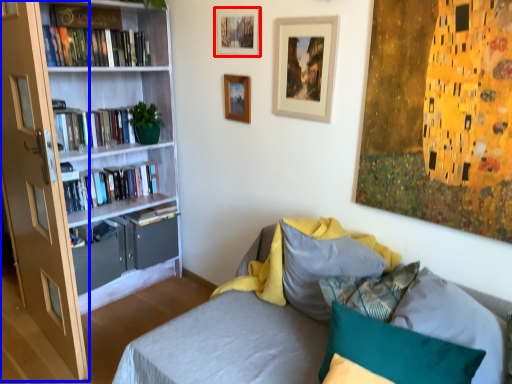
Question: Which object is closer to the camera taking this photo, picture frame (highlighted by a red box) or glass door (highlighted by a blue box)?

Choices:
 (A) picture frame
 (B) glass door

Answer: (B)